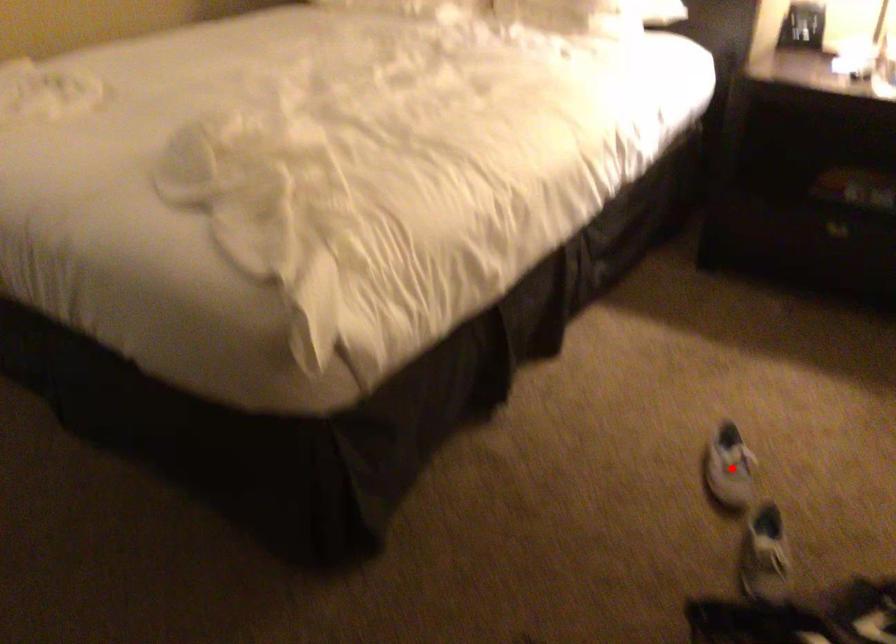
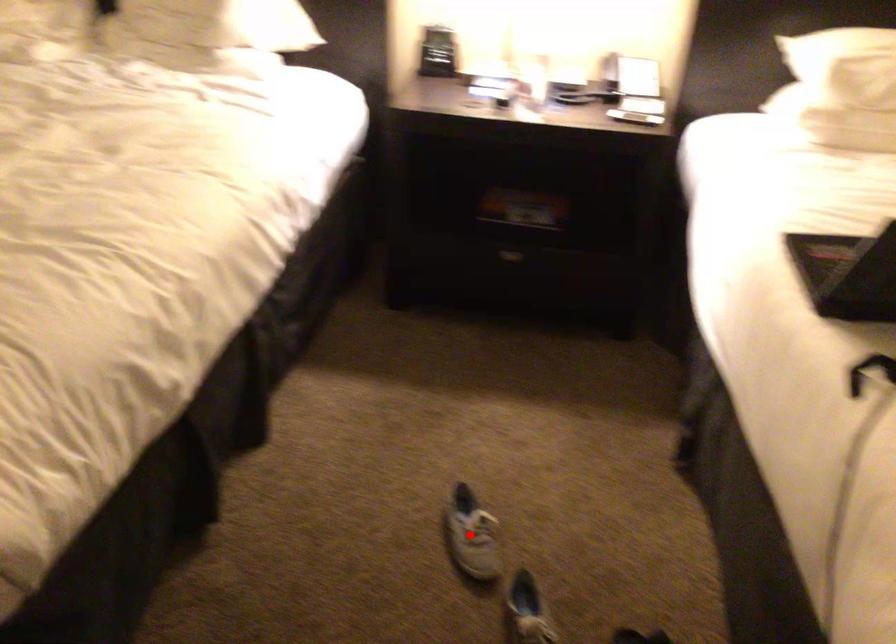
I am providing you with two images of the same scene from different viewpoints. A red point is marked on the first image and another point is marked on the second image. Do the highlighted points in image1 and image2 indicate the same real-world spot?

Yes